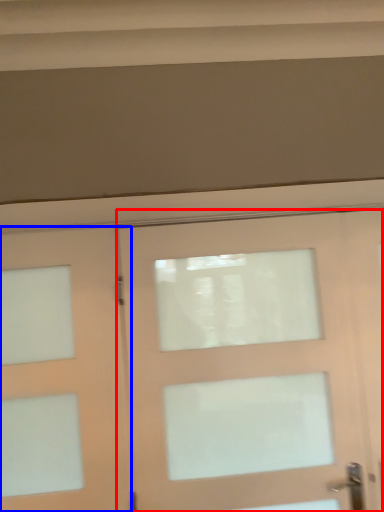
Question: Which object appears farthest to the camera in this image, door (highlighted by a red box) or door (highlighted by a blue box)?

Choices:
 (A) door
 (B) door

Answer: (B)